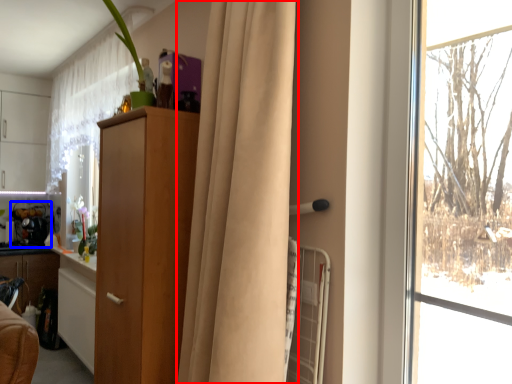
Question: Which object is further to the camera taking this photo, curtain (highlighted by a red box) or appliance (highlighted by a blue box)?

Choices:
 (A) curtain
 (B) appliance

Answer: (B)